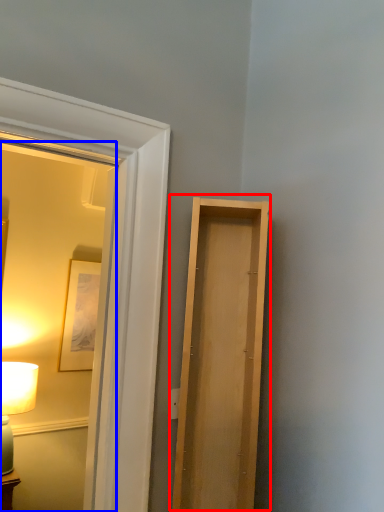
Question: Among these objects, which one is farthest to the camera, door (highlighted by a red box) or mirror (highlighted by a blue box)?

Choices:
 (A) door
 (B) mirror

Answer: (A)